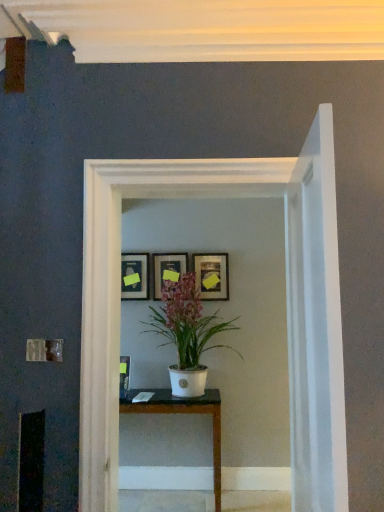
Question: Is white glossy pot at center to the right of white glossy glass door at center from the viewer's perspective?

Choices:
 (A) yes
 (B) no

Answer: (B)

Question: From the image's perspective, does white glossy pot at center appear lower than white glossy glass door at center?

Choices:
 (A) no
 (B) yes

Answer: (B)

Question: Does white glossy pot at center contain white glossy glass door at center?

Choices:
 (A) yes
 (B) no

Answer: (B)

Question: From a real-world perspective, is white glossy pot at center physically below white glossy glass door at center?

Choices:
 (A) yes
 (B) no

Answer: (A)

Question: From a real-world perspective, is white glossy pot at center over white glossy glass door at center?

Choices:
 (A) no
 (B) yes

Answer: (A)

Question: From a real-world perspective, is white glossy glass door at center above or below matte black picture frame at center, the second picture frame in the left-to-right sequence?

Choices:
 (A) above
 (B) below

Answer: (B)

Question: Is point (130, 187) closer or farther from the camera than point (178, 262)?

Choices:
 (A) farther
 (B) closer

Answer: (B)

Question: Based on their sizes in the image, would you say white glossy glass door at center is bigger or smaller than matte black picture frame at center, the second picture frame in the left-to-right sequence?

Choices:
 (A) big
 (B) small

Answer: (A)

Question: Looking at their shapes, would you say white glossy glass door at center is wider or thinner than matte black picture frame at center, which is counted as the 2th picture frame, starting from the right?

Choices:
 (A) wide
 (B) thin

Answer: (A)

Question: Considering the positions of white glossy glass door at center and white glossy pot at center in the image, is white glossy glass door at center taller or shorter than white glossy pot at center?

Choices:
 (A) tall
 (B) short

Answer: (A)

Question: From the image's perspective, is white glossy glass door at center located above or below white glossy pot at center?

Choices:
 (A) below
 (B) above

Answer: (B)

Question: In terms of size, does white glossy glass door at center appear bigger or smaller than white glossy pot at center?

Choices:
 (A) small
 (B) big

Answer: (A)

Question: Is white glossy glass door at center inside the boundaries of white glossy pot at center, or outside?

Choices:
 (A) outside
 (B) inside

Answer: (A)

Question: Is point (216, 289) positioned closer to the camera than point (213, 449)?

Choices:
 (A) closer
 (B) farther

Answer: (B)

Question: Considering the positions of matte gold picture frame at center, the first picture frame viewed from the right, and white glossy table at center in the image, is matte gold picture frame at center, the first picture frame viewed from the right, bigger or smaller than white glossy table at center?

Choices:
 (A) big
 (B) small

Answer: (B)